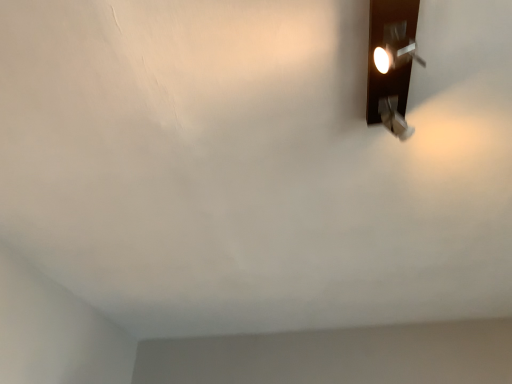
What do you see at coordinates (391, 61) in the screenshot?
I see `matte black lamp at upper right` at bounding box center [391, 61].

Where is `matte black lamp at upper right`? The image size is (512, 384). matte black lamp at upper right is located at coordinates (391, 61).

Identify the location of matte black lamp at upper right. This screenshot has height=384, width=512. (391, 61).